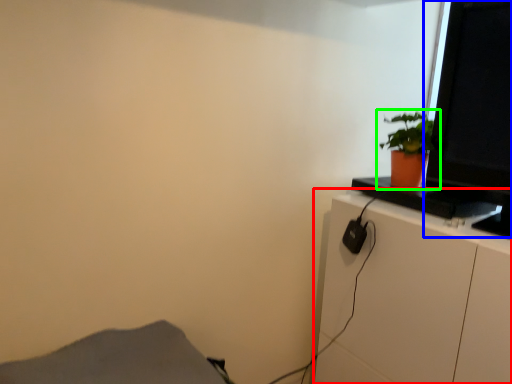
Question: Which object is positioned closest to cabinetry (highlighted by a red box)? Select from computer monitor (highlighted by a blue box) and houseplant (highlighted by a green box).

Choices:
 (A) computer monitor
 (B) houseplant

Answer: (A)